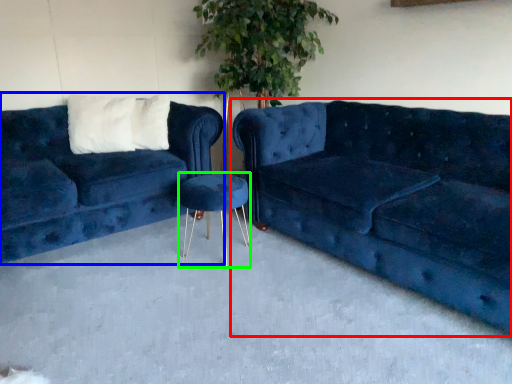
Question: Which object is the farthest from studio couch (highlighted by a red box)? Choose among these: studio couch (highlighted by a blue box) or bar stool (highlighted by a green box).

Choices:
 (A) studio couch
 (B) bar stool

Answer: (A)